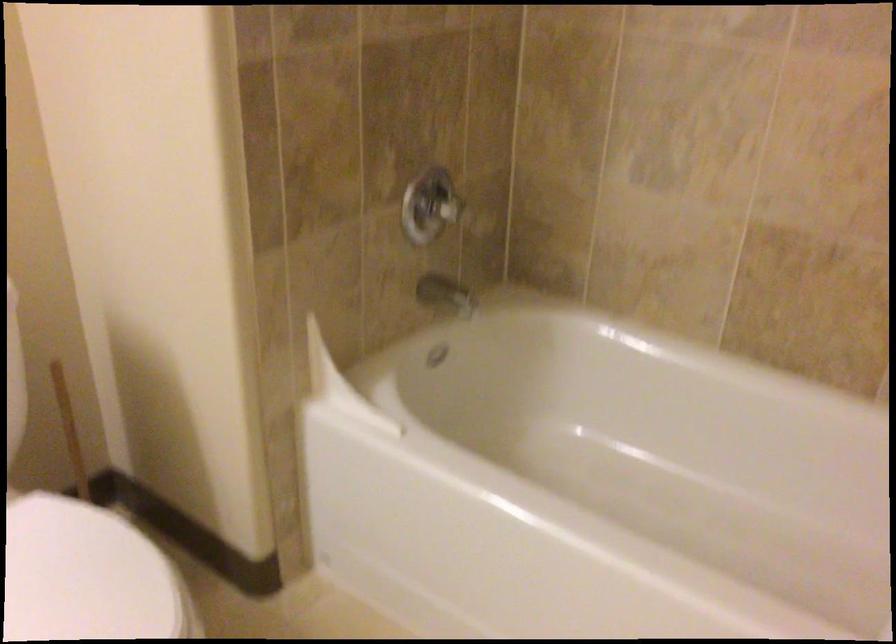
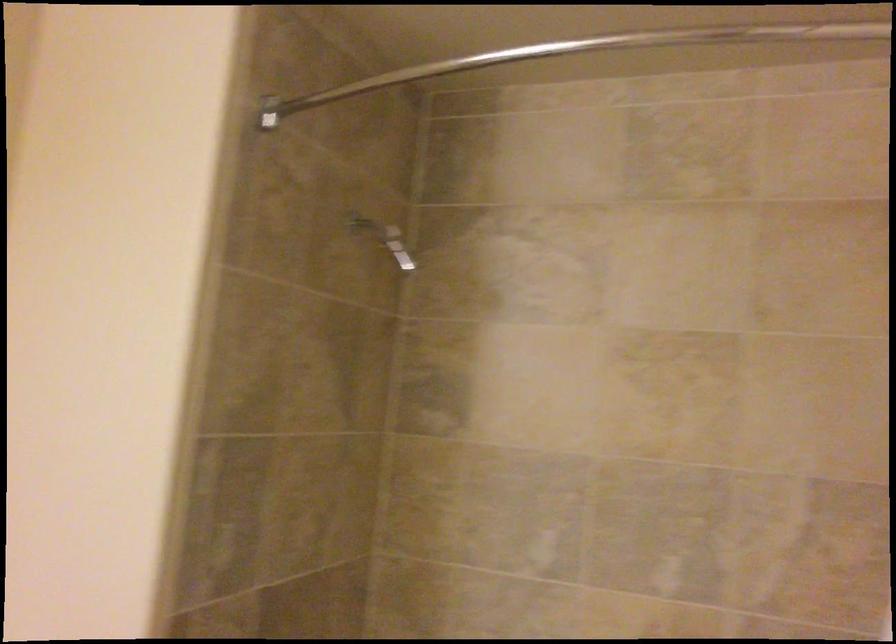
Question: How did the camera likely rotate?

Choices:
 (A) Left
 (B) Right
 (C) Up
 (D) Down

Answer: (C)